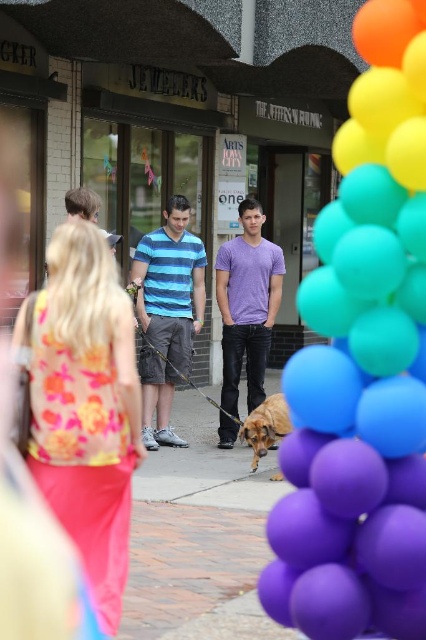
Between point (172, 204) and point (261, 442), which one is positioned in front?

Point (261, 442) is more forward.

What do you see at coordinates (170, 284) in the screenshot? I see `blue striped shirt at center` at bounding box center [170, 284].

Which is in front, point (157, 435) or point (270, 401)?

Point (270, 401) is in front.

This screenshot has height=640, width=426. In order to click on blue striped shirt at center in this screenshot , I will do `click(170, 284)`.

Is point (319, 396) behind point (253, 204)?

That is False.

Is purple matte balloons at right further to camera compared to purple matte shirt at center?

No, purple matte balloons at right is closer to the viewer.

Find the location of `purple matte balloons at right`. purple matte balloons at right is located at coordinates (362, 365).

Is purple matte shirt at center wider than brown matte dog at center?

Yes.

Which is behind, point (255, 307) or point (241, 433)?

The point (255, 307) is more distant.

Find the location of a particular element. This screenshot has height=640, width=426. purple matte shirt at center is located at coordinates (245, 310).